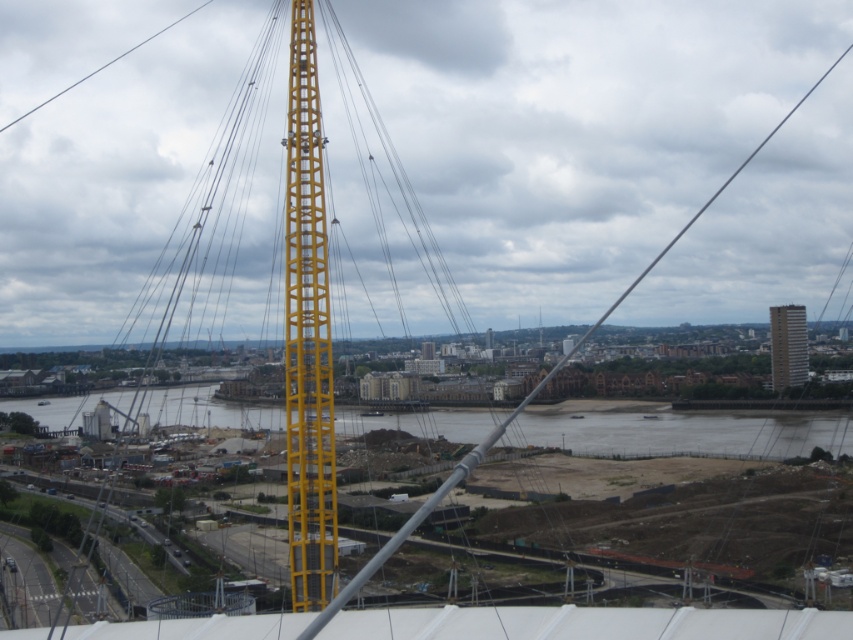
Question: Which point is farther to the camera?

Choices:
 (A) (815, 422)
 (B) (772, 362)
 (C) (292, 340)

Answer: (B)

Question: Does brown sand at lower center have a larger size compared to gray concrete building at right?

Choices:
 (A) no
 (B) yes

Answer: (B)

Question: Is matte yellow crane at center closer to camera compared to gray concrete building at right?

Choices:
 (A) no
 (B) yes

Answer: (B)

Question: Which point is farther to the camera?

Choices:
 (A) brown sand at lower center
 (B) gray concrete building at right
 (C) yellow metallic tower at center
 (D) matte yellow crane at center

Answer: (B)

Question: In this image, where is yellow metallic tower at center located relative to gray concrete building at right?

Choices:
 (A) below
 (B) above

Answer: (B)

Question: Which of the following is the farthest from the observer?

Choices:
 (A) (51, 406)
 (B) (788, 321)
 (C) (318, 419)
 (D) (398, 637)

Answer: (A)